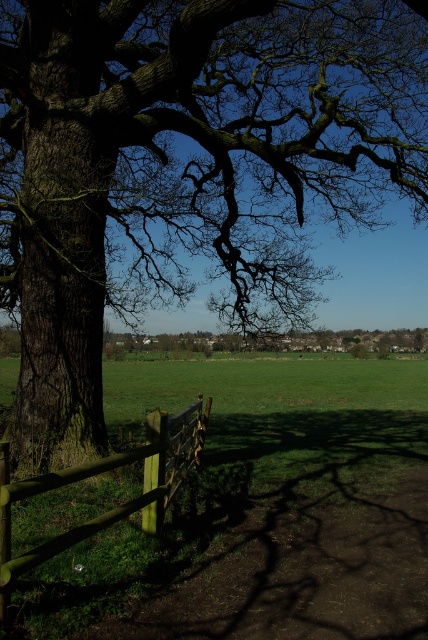
Between dark brown textured oak tree at left and wooden fence at lower left, which one appears on the right side from the viewer's perspective?

dark brown textured oak tree at left

Who is more forward, (184,200) or (145,456)?

Positioned in front is point (145,456).

Describe the element at coordinates (184, 168) in the screenshot. I see `dark brown textured oak tree at left` at that location.

You are a GUI agent. You are given a task and a screenshot of the screen. Output one action in this format:
    pyautogui.click(x=<x>, y=<y>)
    Task: Click on the dark brown textured oak tree at left
    
    Given the screenshot: What is the action you would take?
    pyautogui.click(x=184, y=168)